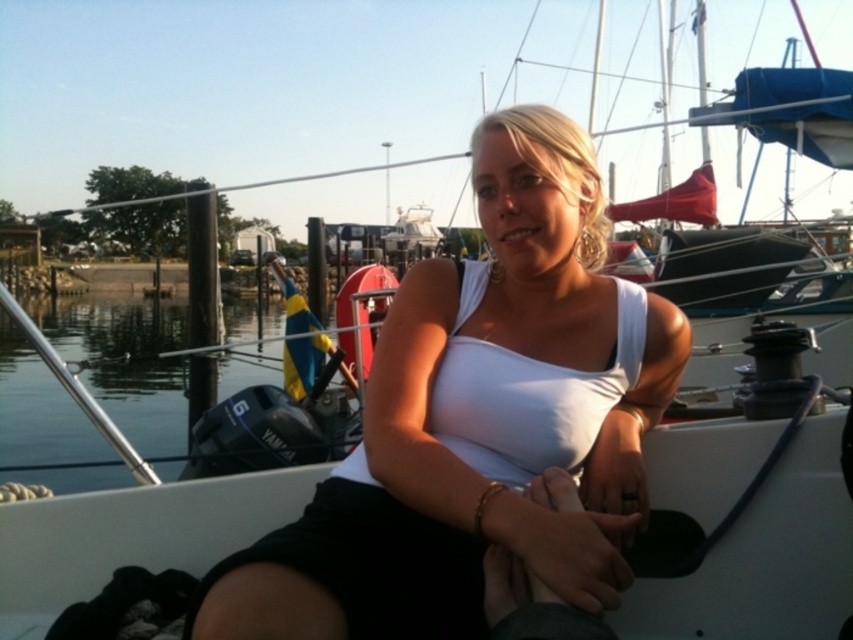
Question: Can you confirm if white matte tank top at center is smaller than clear water at lower left?

Choices:
 (A) yes
 (B) no

Answer: (A)

Question: Can you confirm if white matte tank top at center is bigger than clear water at lower left?

Choices:
 (A) yes
 (B) no

Answer: (B)

Question: Which point is closer to the camera?

Choices:
 (A) clear water at lower left
 (B) white matte tank top at center

Answer: (B)

Question: Is white matte tank top at center bigger than clear water at lower left?

Choices:
 (A) no
 (B) yes

Answer: (A)

Question: Which object is farther from the camera taking this photo?

Choices:
 (A) white matte tank top at center
 (B) clear water at lower left

Answer: (B)